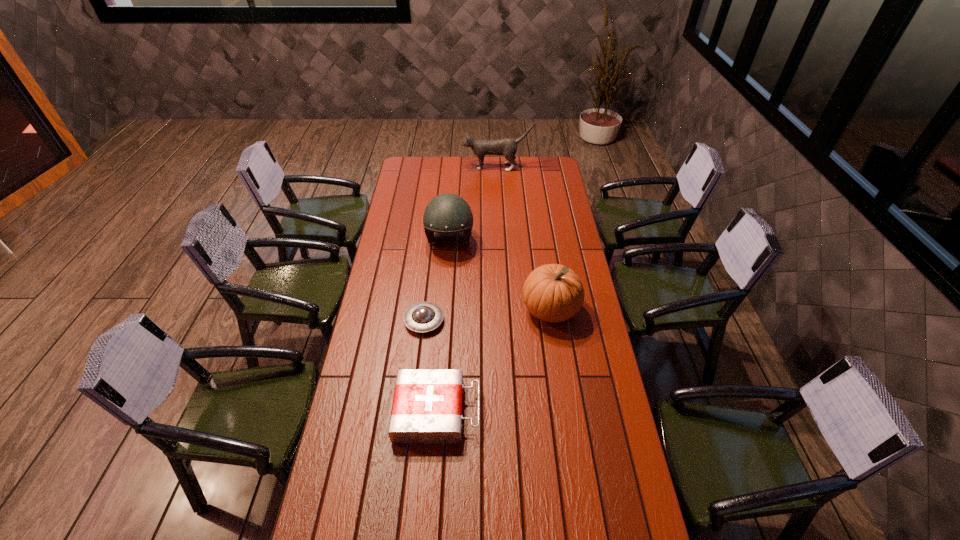
Find the location of a particular element. This screenshot has height=540, width=960. vacant area situated 0.200m on the front side of the nearest object is located at coordinates (539, 411).

Locate an element on the screen. This screenshot has width=960, height=540. free space located on the back of the saucer is located at coordinates (427, 292).

Locate an element on the screen. This screenshot has width=960, height=540. object that is at the far edge is located at coordinates (x=508, y=147).

You are a GUI agent. You are given a task and a screenshot of the screen. Output one action in this format:
    pyautogui.click(x=<x>, y=<y>)
    Task: Click on the object present at the left edge
    This screenshot has height=540, width=960.
    Given the screenshot: What is the action you would take?
    pyautogui.click(x=421, y=317)

Where is `cat situated at the right edge`? The height and width of the screenshot is (540, 960). cat situated at the right edge is located at coordinates pos(508,147).

Where is `pumpkin at the right edge`? pumpkin at the right edge is located at coordinates (554, 293).

Locate an element on the screen. object that is at the far right corner is located at coordinates (508, 147).

This screenshot has height=540, width=960. In the image, there is a desktop. In order to click on vacant space at the left edge in this screenshot , I will do `click(373, 316)`.

Find the location of a particular element. The width and height of the screenshot is (960, 540). vacant space at the right edge of the desktop is located at coordinates (590, 502).

In the image, there is a desktop. Find the location of `vacant space at the far right corner`. vacant space at the far right corner is located at coordinates (552, 165).